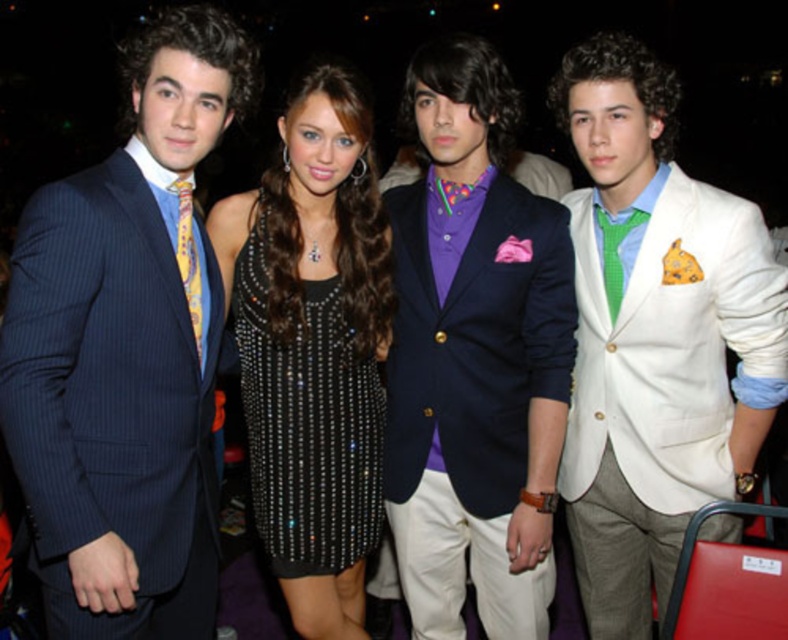
You are a photographer at the event and want to ensure that both the pinstriped suit at left and the white textured blazer at center are clearly visible in the photo. Based on their positions, which one might be partially obscured if you frame the shot to include all four people?

The pinstriped suit at left is positioned over the white textured blazer at center, so the white textured blazer at center might be partially obscured in the photo.

You are standing in the ballroom and want to move towards the two points marked in the image. Which point, point (259, 477) or point (604, 241), will you reach first?

Point (259, 477) is closer to the viewer than point (604, 241), so you will reach point (259, 477) first.

You are a photographer at the event and want to capture a photo that includes both the pinstriped suit at left and the white textured blazer at center. Based on their positions, which one should you focus on first to ensure both are in the frame?

The pinstriped suit at left is in front of the white textured blazer at center, so focus on the pinstriped suit at left first to ensure both are visible in the frame.